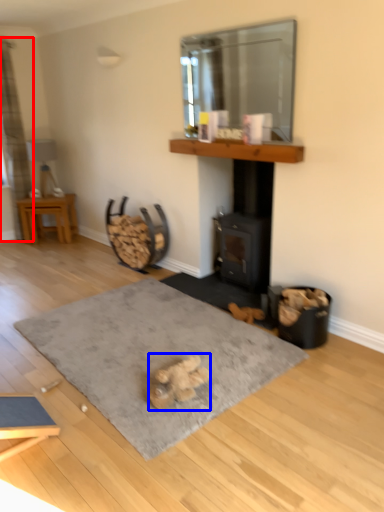
Question: Which object appears farthest to the camera in this image, curtain (highlighted by a red box) or animal (highlighted by a blue box)?

Choices:
 (A) curtain
 (B) animal

Answer: (A)